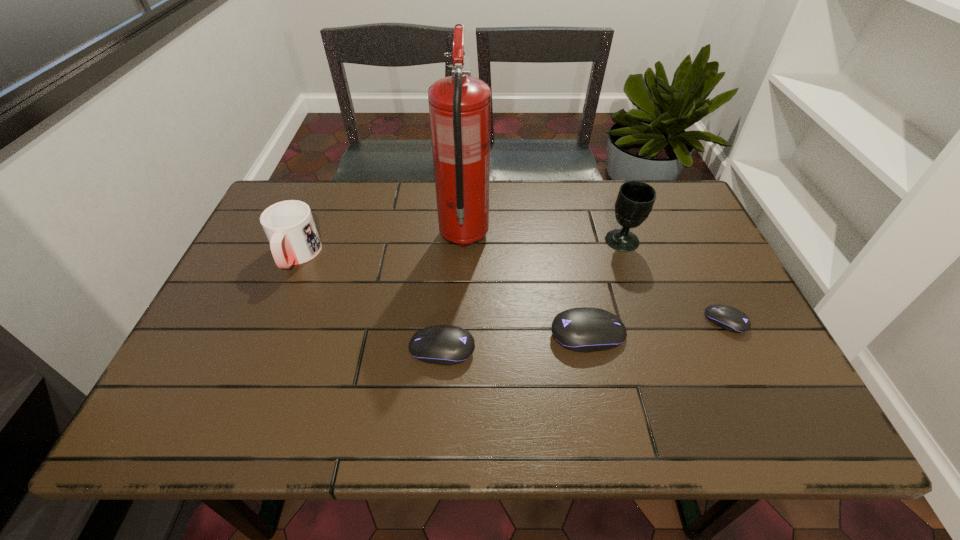
The height and width of the screenshot is (540, 960). I want to click on blank area located on the left of the leftmost computer mouse, so click(x=337, y=349).

Where is `vacant space situated on the front of the second computer mouse from right to left`? vacant space situated on the front of the second computer mouse from right to left is located at coordinates (599, 387).

Locate an element on the screen. The height and width of the screenshot is (540, 960). vacant area situated 0.280m on the left of the rightmost object is located at coordinates (588, 321).

Where is `free spot located on the front of the fifth shortest object`? The width and height of the screenshot is (960, 540). free spot located on the front of the fifth shortest object is located at coordinates (638, 288).

Image resolution: width=960 pixels, height=540 pixels. Find the location of `free space located on the handle side the fire extinguisher`. free space located on the handle side the fire extinguisher is located at coordinates (467, 180).

The width and height of the screenshot is (960, 540). Find the location of `vacant region located on the handle side the fire extinguisher`. vacant region located on the handle side the fire extinguisher is located at coordinates (466, 198).

Identify the location of free space located 0.070m on the side of the leftmost object with the handle. The width and height of the screenshot is (960, 540). (277, 299).

Where is `object located in the far edge section of the desktop`? The width and height of the screenshot is (960, 540). object located in the far edge section of the desktop is located at coordinates (459, 105).

Where is `object that is at the near edge`? object that is at the near edge is located at coordinates (446, 345).

The image size is (960, 540). What are the coordinates of `object located at the left edge` in the screenshot? It's located at (289, 226).